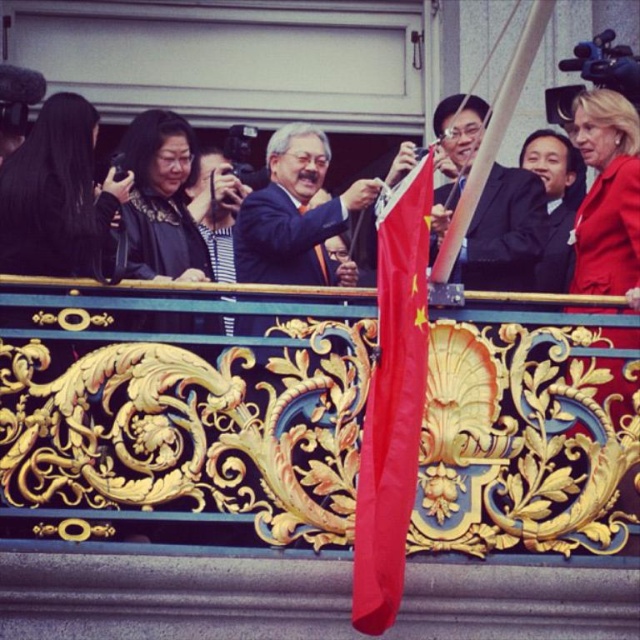
You are a photographer standing on the balcony and want to capture a photo that includes both the red matte flag at center and the smooth black suit at center. Since the flag is smaller in width, where should you position the camera to ensure both objects are fully visible in the frame?

The red matte flag at center has a lesser width compared to smooth black suit at center, so to include both fully in the frame, position the camera so that the flag is centered and the suit is placed slightly to the side, ensuring its full width fits within the image.

You are a photographer trying to capture a clear shot of the red matte flag at center and the smooth black suit at center from below the balcony. Which object will appear taller in your photo?

The red matte flag at center will appear taller in the photo since it has a greater height compared to the smooth black suit at center according to the description.

You are a photographer trying to capture a clear shot of the red matte flag at center and the smooth black suit at center from the balcony. Since you want both subjects to be visible in the frame, which object should you focus on first to ensure it takes up more space in the photo?

The smooth black suit at center occupies more space than the red matte flag at center, so you should focus on the smooth black suit at center first to ensure it takes up more space in the photo.